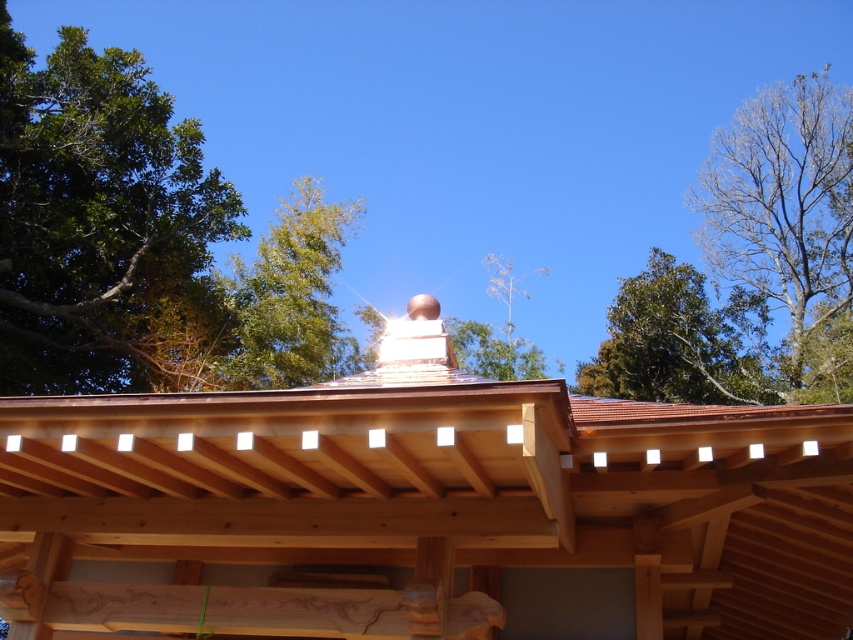
Which is more to the left, shiny copper roof at center or bare branches at upper right?

shiny copper roof at center is more to the left.

Can you confirm if shiny copper roof at center is shorter than bare branches at upper right?

Yes.

Is point (405, 502) behind point (838, 282)?

No, (405, 502) is closer to viewer.

You are a GUI agent. You are given a task and a screenshot of the screen. Output one action in this format:
    pyautogui.click(x=<x>, y=<y>)
    Task: Click on the shiny copper roof at center
    The image size is (853, 640).
    Given the screenshot: What is the action you would take?
    pyautogui.click(x=422, y=509)

Who is higher up, green leafy tree at upper left or green leafy tree at upper center?

green leafy tree at upper left is above.

Does green leafy tree at upper left have a greater width compared to green leafy tree at upper center?

Correct, the width of green leafy tree at upper left exceeds that of green leafy tree at upper center.

Find the location of a particular element. The width and height of the screenshot is (853, 640). green leafy tree at upper left is located at coordinates (x=96, y=216).

Is shiny copper roof at center above green leafy tree at upper center?

Actually, shiny copper roof at center is below green leafy tree at upper center.

Is shiny copper roof at center smaller than green leafy tree at upper center?

Correct, shiny copper roof at center occupies less space than green leafy tree at upper center.

Which is in front, point (334, 499) or point (309, 374)?

Point (334, 499) is more forward.

Locate an element on the screen. shiny copper roof at center is located at coordinates (422, 509).